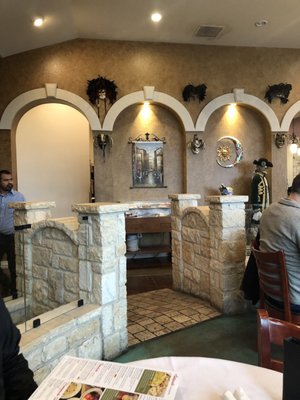
What are the coordinates of `lights in ceiling` in the screenshot? It's located at (41, 23), (153, 17).